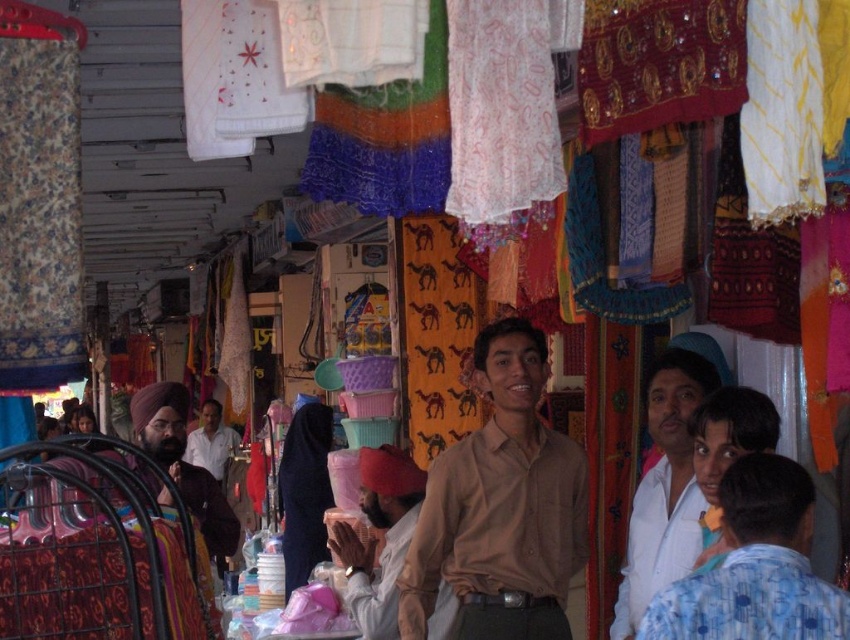
Is light blue printed shirt at center bigger than light brown cotton shirt at center?

No.

Is light blue printed shirt at center above light brown cotton shirt at center?

Yes, light blue printed shirt at center is above light brown cotton shirt at center.

Does point (751, 499) come in front of point (394, 600)?

Yes, point (751, 499) is in front of point (394, 600).

Where is `light blue printed shirt at center`? The image size is (850, 640). light blue printed shirt at center is located at coordinates (756, 566).

Who is more distant from viewer, (412, 472) or (218, 458)?

Positioned behind is point (218, 458).

Does point (361, 502) lie behind point (219, 464)?

No.

Where is `light brown cotton shirt at center`? This screenshot has height=640, width=850. light brown cotton shirt at center is located at coordinates (383, 538).

Is light blue printed shirt at center bigger than matte brown turban at left?

Actually, light blue printed shirt at center might be smaller than matte brown turban at left.

Between point (675, 620) and point (200, 474), which one is positioned in front?

Point (675, 620)

Find the location of `light blue printed shirt at center`. light blue printed shirt at center is located at coordinates (756, 566).